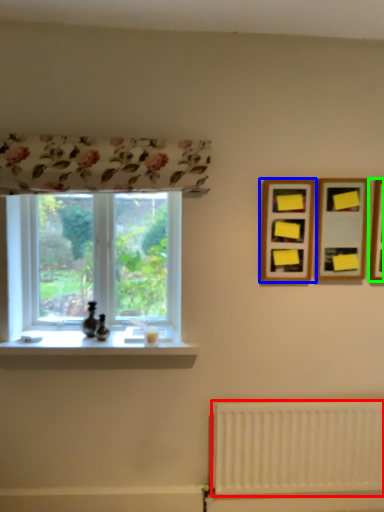
Question: Which object is the closest to the radiator (highlighted by a red box)? Choose among these: picture frame (highlighted by a blue box) or picture frame (highlighted by a green box).

Choices:
 (A) picture frame
 (B) picture frame

Answer: (A)